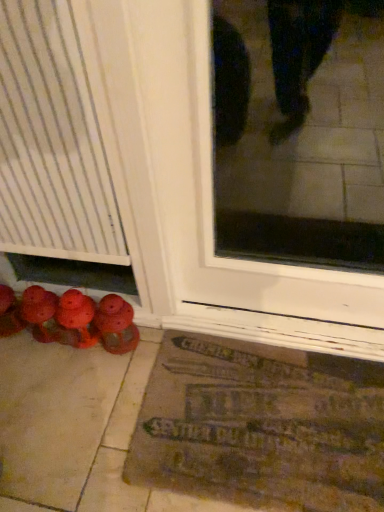
This screenshot has height=512, width=384. Describe the element at coordinates (116, 325) in the screenshot. I see `matte red shoes at lower left, positioned as the 2th footwear in left-to-right order` at that location.

Locate an element on the screen. matte red shoes at lower left, positioned as the 2th footwear in left-to-right order is located at coordinates (116, 325).

Based on the photo, how distant is brown textured mat at lower center from matte red shoes at lower left, positioned as the 2th footwear in left-to-right order?

brown textured mat at lower center is 42.32 centimeters away from matte red shoes at lower left, positioned as the 2th footwear in left-to-right order.

From the image's perspective, does brown textured mat at lower center appear lower than matte red shoes at lower left, positioned as the first footwear in right-to-left order?

Indeed, from the image's perspective, brown textured mat at lower center is shown beneath matte red shoes at lower left, positioned as the first footwear in right-to-left order.

Based on the photo, does brown textured mat at lower center have a lesser height compared to matte red shoes at lower left, positioned as the first footwear in right-to-left order?

Yes, brown textured mat at lower center is shorter than matte red shoes at lower left, positioned as the first footwear in right-to-left order.

Between brown textured mat at lower center and matte red shoes at lower left, positioned as the first footwear in right-to-left order, which one has smaller size?

With smaller size is matte red shoes at lower left, positioned as the first footwear in right-to-left order.

Is matte red shoes at lower left, positioned as the first footwear in right-to-left order, oriented towards matte red shoes at lower left, which is counted as the second footwear, starting from the right?

No.

From the picture: Considering the relative positions of matte red shoes at lower left, positioned as the first footwear in right-to-left order, and matte red shoes at lower left, which is counted as the second footwear, starting from the right, in the image provided, is matte red shoes at lower left, positioned as the first footwear in right-to-left order, to the left of matte red shoes at lower left, which is counted as the second footwear, starting from the right, from the viewer's perspective?

No.

From a real-world perspective, does matte red shoes at lower left, positioned as the first footwear in right-to-left order, sit lower than matte red shoes at lower left, which is counted as the second footwear, starting from the right?

Yes.

Can you tell me how much matte red shoes at lower left, positioned as the 2th footwear in left-to-right order, and matte red shoes at lower left, which is counted as the second footwear, starting from the right, differ in facing direction?

The facing directions of matte red shoes at lower left, positioned as the 2th footwear in left-to-right order, and matte red shoes at lower left, which is counted as the second footwear, starting from the right, are 0.00133 degrees apart.

Is matte red shoes at lower left, positioned as the 2th footwear in left-to-right order, with brown textured mat at lower center?

matte red shoes at lower left, positioned as the 2th footwear in left-to-right order, and brown textured mat at lower center are not in contact.

Is point (129, 304) closer or farther from the camera than point (324, 437)?

Clearly, point (129, 304) is more distant from the camera than point (324, 437).

In terms of height, does matte red shoes at lower left, positioned as the 2th footwear in left-to-right order, look taller or shorter compared to brown textured mat at lower center?

In the image, matte red shoes at lower left, positioned as the 2th footwear in left-to-right order, appears to be taller than brown textured mat at lower center.

In the image, is matte red shoes at lower left, positioned as the first footwear in right-to-left order, positioned in front of or behind brown textured mat at lower center?

In the image, matte red shoes at lower left, positioned as the first footwear in right-to-left order, appears behind brown textured mat at lower center.

Is point (4, 296) positioned behind point (135, 348)?

Yes, point (4, 296) is behind point (135, 348).

Is matte red shoes at lower left, which is counted as the second footwear, starting from the right, completely or partially outside of matte red shoes at lower left, positioned as the 2th footwear in left-to-right order?

Yes, matte red shoes at lower left, which is counted as the second footwear, starting from the right, is located beyond the bounds of matte red shoes at lower left, positioned as the 2th footwear in left-to-right order.

In the image, there is a matte red shoes at lower left, positioned as the first footwear in right-to-left order. Where is `footwear above it (from the image's perspective)`? The image size is (384, 512). footwear above it (from the image's perspective) is located at coordinates (9, 313).

Is matte red shoes at lower left, which is counted as the second footwear, starting from the right, bigger than matte red shoes at lower left, positioned as the first footwear in right-to-left order?

Actually, matte red shoes at lower left, which is counted as the second footwear, starting from the right, might be smaller than matte red shoes at lower left, positioned as the first footwear in right-to-left order.

Is matte red shoes at lower left, which is counted as the second footwear, starting from the right, inside brown textured mat at lower center?

No, matte red shoes at lower left, which is counted as the second footwear, starting from the right, is not surrounded by brown textured mat at lower center.

This screenshot has height=512, width=384. What are the coordinates of `bath mat below the matte red shoes at lower left, which is counted as the second footwear, starting from the right (from the image's perspective)` in the screenshot? It's located at (261, 426).

From a real-world perspective, is brown textured mat at lower center on matte red shoes at lower left, which appears as the 1th footwear when viewed from the left?

No.

Between brown textured mat at lower center and matte red shoes at lower left, which is counted as the second footwear, starting from the right, which one has smaller size?

With smaller size is matte red shoes at lower left, which is counted as the second footwear, starting from the right.

Is matte red shoes at lower left, which is counted as the second footwear, starting from the right, taller or shorter than brown textured mat at lower center?

matte red shoes at lower left, which is counted as the second footwear, starting from the right, is taller than brown textured mat at lower center.

Would you say brown textured mat at lower center is part of matte red shoes at lower left, which is counted as the second footwear, starting from the right,'s contents?

No, brown textured mat at lower center is not a part of matte red shoes at lower left, which is counted as the second footwear, starting from the right.

From the image's perspective, is matte red shoes at lower left, which is counted as the second footwear, starting from the right, beneath brown textured mat at lower center?

No.

From a real-world perspective, is matte red shoes at lower left, which appears as the 1th footwear when viewed from the left, physically below brown textured mat at lower center?

No, from a real-world perspective, matte red shoes at lower left, which appears as the 1th footwear when viewed from the left, is not under brown textured mat at lower center.

Identify the location of footwear that is the 1st object to the left of the brown textured mat at lower center, starting at the anchor. (116, 325).

You are a GUI agent. You are given a task and a screenshot of the screen. Output one action in this format:
    pyautogui.click(x=<x>, y=<y>)
    Task: Click on the footwear lying in front of the matte red shoes at lower left, which is counted as the second footwear, starting from the right
    
    Given the screenshot: What is the action you would take?
    pyautogui.click(x=116, y=325)

From the image, which object appears to be farther from brown textured mat at lower center, matte red shoes at lower left, which appears as the 1th footwear when viewed from the left, or matte red shoes at lower left, positioned as the first footwear in right-to-left order?

matte red shoes at lower left, which appears as the 1th footwear when viewed from the left, is further to brown textured mat at lower center.

Which object lies nearer to the anchor point matte red shoes at lower left, positioned as the first footwear in right-to-left order, matte red shoes at lower left, which appears as the 1th footwear when viewed from the left, or brown textured mat at lower center?

The object closer to matte red shoes at lower left, positioned as the first footwear in right-to-left order, is matte red shoes at lower left, which appears as the 1th footwear when viewed from the left.

Which object lies nearer to the anchor point matte red shoes at lower left, which appears as the 1th footwear when viewed from the left, matte red shoes at lower left, positioned as the 2th footwear in left-to-right order, or brown textured mat at lower center?

matte red shoes at lower left, positioned as the 2th footwear in left-to-right order.

Looking at the image, which one is located closer to matte red shoes at lower left, positioned as the 2th footwear in left-to-right order, brown textured mat at lower center or matte red shoes at lower left, which is counted as the second footwear, starting from the right?

Based on the image, matte red shoes at lower left, which is counted as the second footwear, starting from the right, appears to be nearer to matte red shoes at lower left, positioned as the 2th footwear in left-to-right order.

Looking at the image, which one is located further to matte red shoes at lower left, which is counted as the second footwear, starting from the right, brown textured mat at lower center or matte red shoes at lower left, positioned as the 2th footwear in left-to-right order?

brown textured mat at lower center lies further to matte red shoes at lower left, which is counted as the second footwear, starting from the right, than the other object.

Looking at the image, which one is located further to brown textured mat at lower center, matte red shoes at lower left, positioned as the first footwear in right-to-left order, or matte red shoes at lower left, which is counted as the second footwear, starting from the right?

matte red shoes at lower left, which is counted as the second footwear, starting from the right, lies further to brown textured mat at lower center than the other object.

Identify the location of footwear between matte red shoes at lower left, which appears as the 1th footwear when viewed from the left, and brown textured mat at lower center. The width and height of the screenshot is (384, 512). (116, 325).